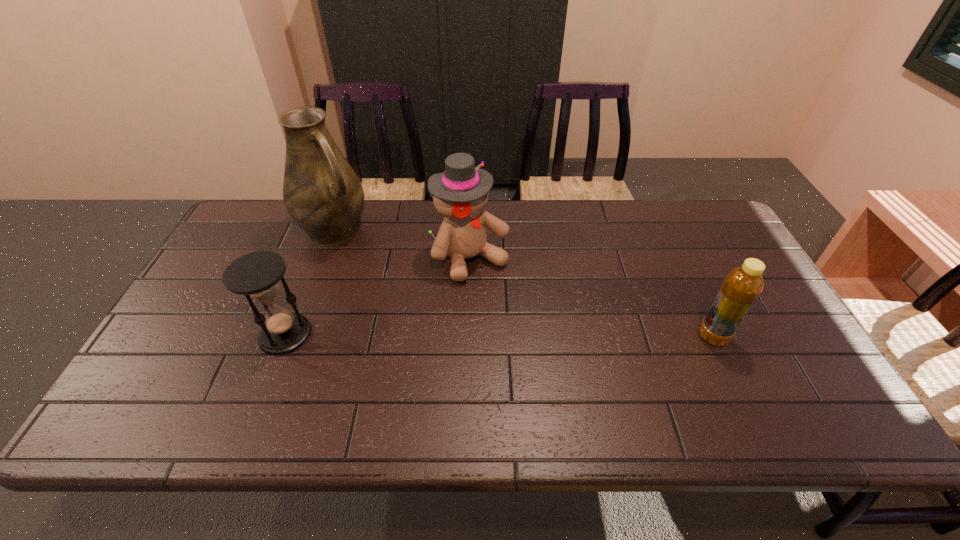
Image resolution: width=960 pixels, height=540 pixels. What are the coordinates of `vacant space on the desktop that is between the hourglass and the rightmost object and is positioned on the handle side of the tallest object` in the screenshot? It's located at (443, 335).

The image size is (960, 540). In order to click on vacant space on the desktop that is between the hourglass and the rightmost object and is positioned on the front-facing side of the third shortest object in this screenshot , I will do `click(541, 336)`.